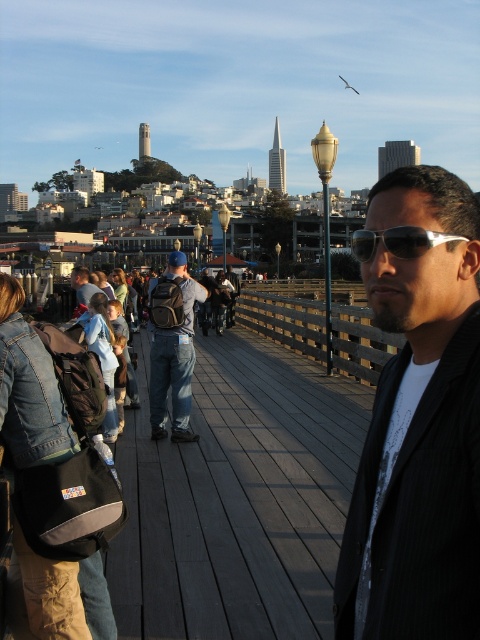
Looking at this image, you are a photographer trying to capture the man on the pier. You notice the sunglasses at center and the denim jacket at center. Which object is located to the right of the other?

The sunglasses at center is positioned on the right side of denim jacket at center.

Based on the photo, you are a photographer trying to capture the man in the black pinstripe suit at center and the denim jacket at center. Which one is positioned lower in the image?

The black pinstripe suit at center is positioned lower than the denim jacket at center in the image.